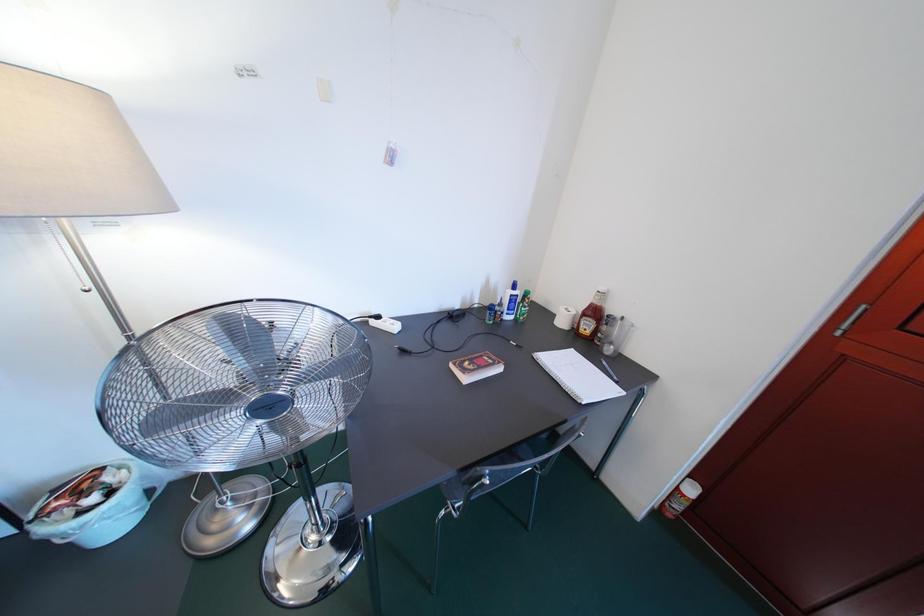
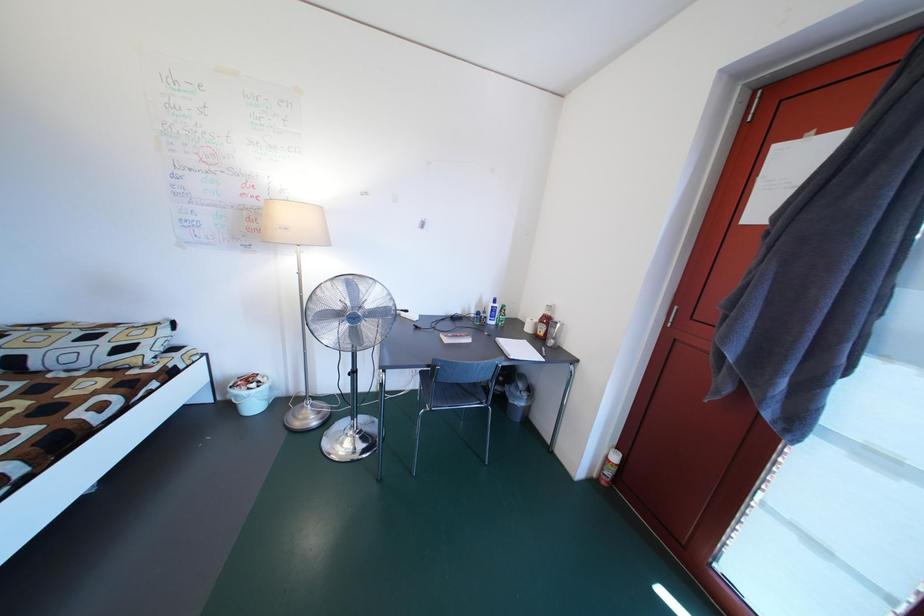
Question: The first image is from the beginning of the video and the second image is from the end. How did the camera likely rotate when shooting the video?

Choices:
 (A) Left
 (B) Right
 (C) Up
 (D) Down

Answer: (C)